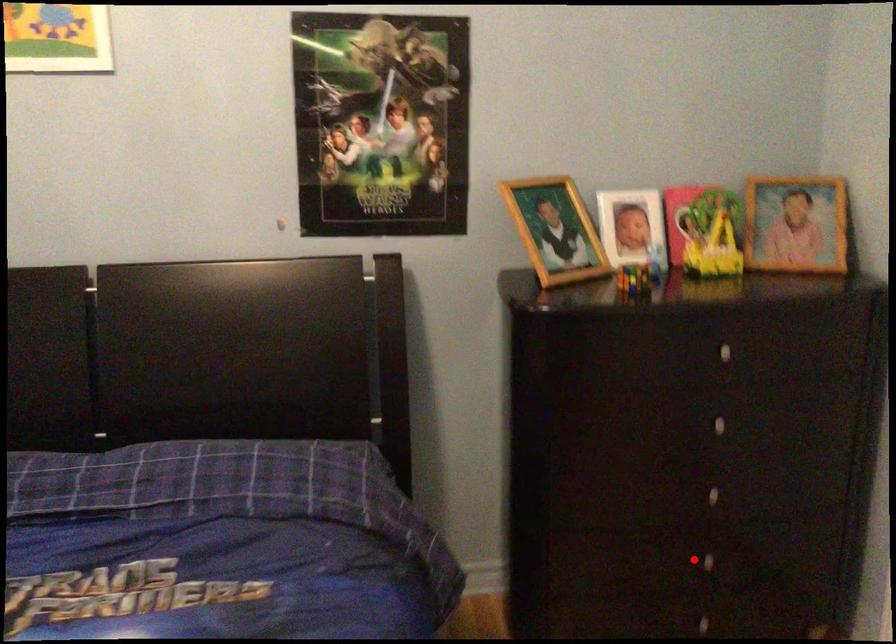
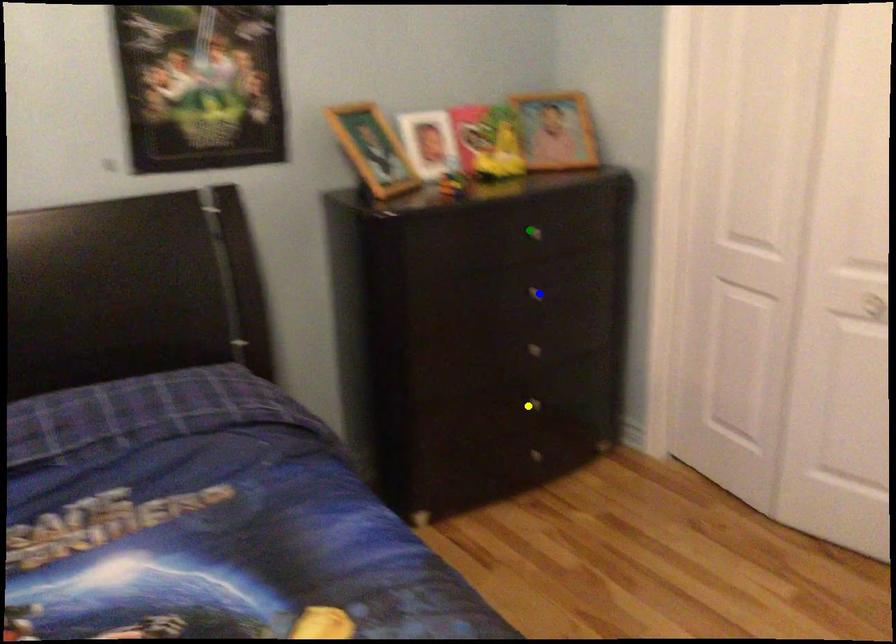
Question: I am providing you with two images of the same scene from different viewpoints. A red point is marked on the first image. You are given multiple points on the second image. Which point in image 2 represents the same 3d spot as the red point in image 1?

Choices:
 (A) yellow point
 (B) green point
 (C) blue point

Answer: (A)